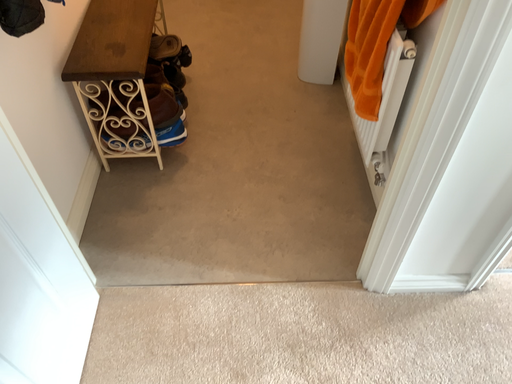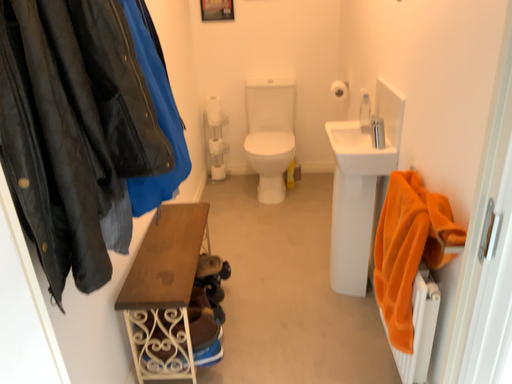
Question: How did the camera likely rotate when shooting the video?

Choices:
 (A) rotated upward
 (B) rotated downward

Answer: (A)